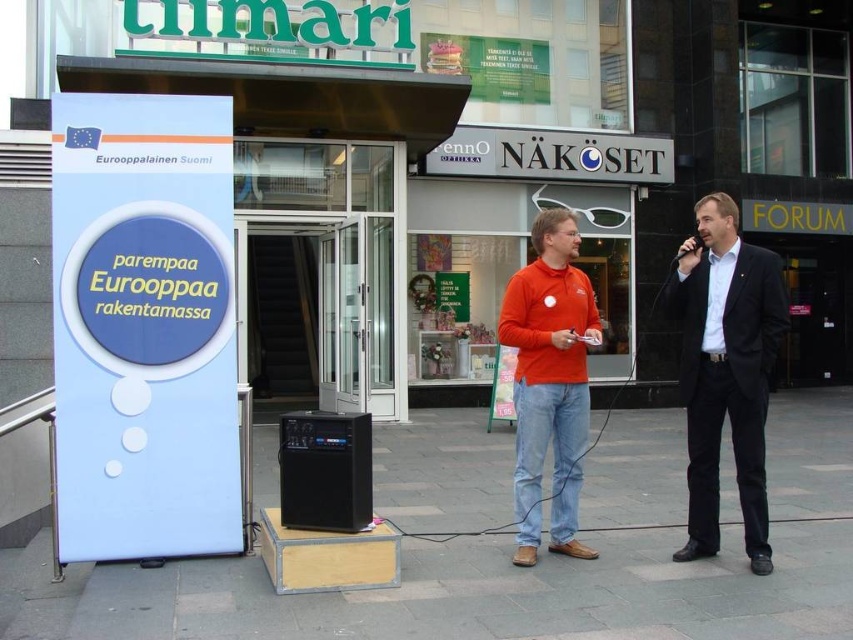
You are standing in front of the commercial building and want to know which of the two points, point (534, 340) or point (344, 442), is closer to you. Based on the scene description, which point is nearer?

Point (534, 340) is further to the viewer than point (344, 442), so the point closer to you is point (344, 442).

You are standing in front of the commercial building and see the orange cotton shirt at center and the black plastic speaker at center. Which object is closer to you?

The orange cotton shirt at center is closer to you because it is further to the viewer than the black plastic speaker at center.

You are a photographer standing in front of the commercial building. You see a dark blue suit at right and a black plastic speaker at center. Which object is taller?

The dark blue suit at right is taller than the black plastic speaker at center according to the description.